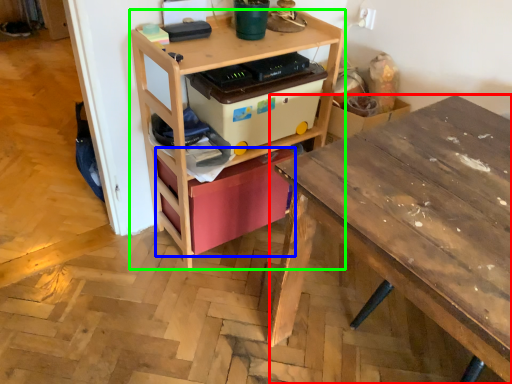
Question: Estimate the real-world distances between objects in this image. Which object is farther from desk (highlighted by a red box), storage box (highlighted by a blue box) or shelf (highlighted by a green box)?

Choices:
 (A) storage box
 (B) shelf

Answer: (B)